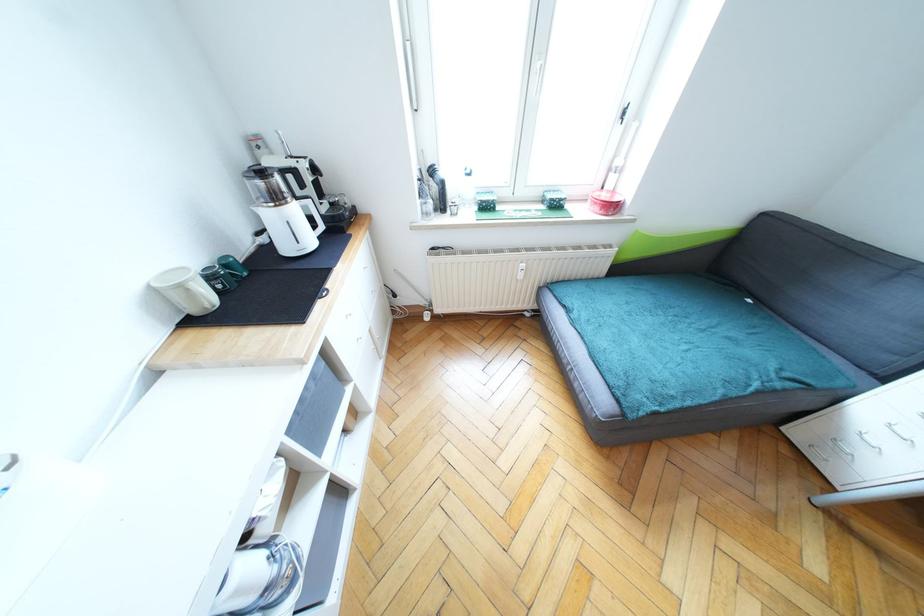
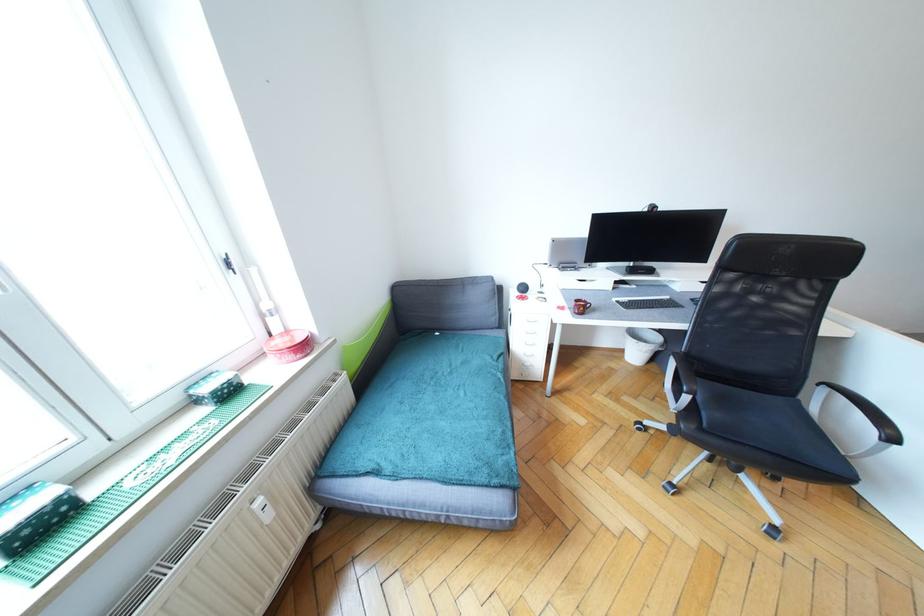
Where in the second image is the point corresponding to [621,163] from the first image?

(270, 307)